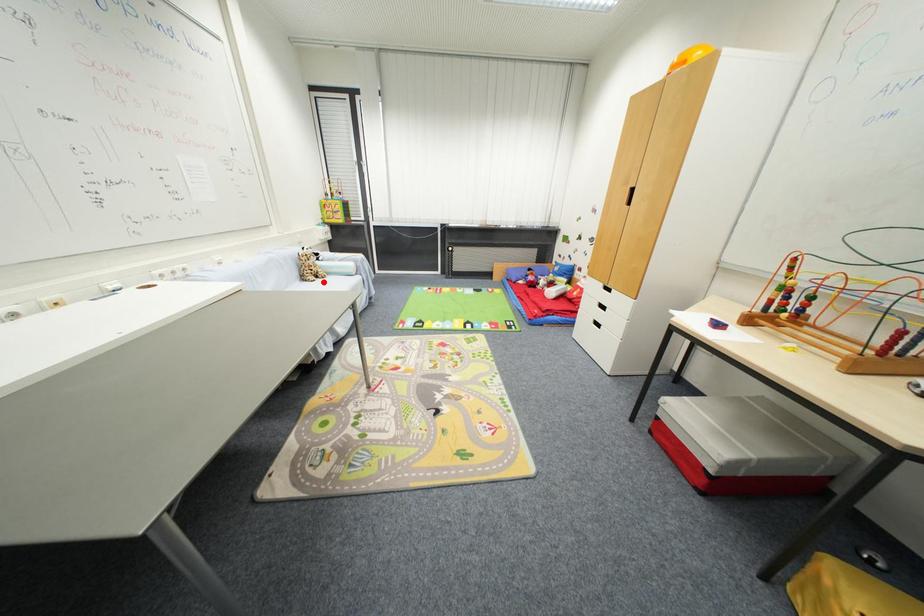
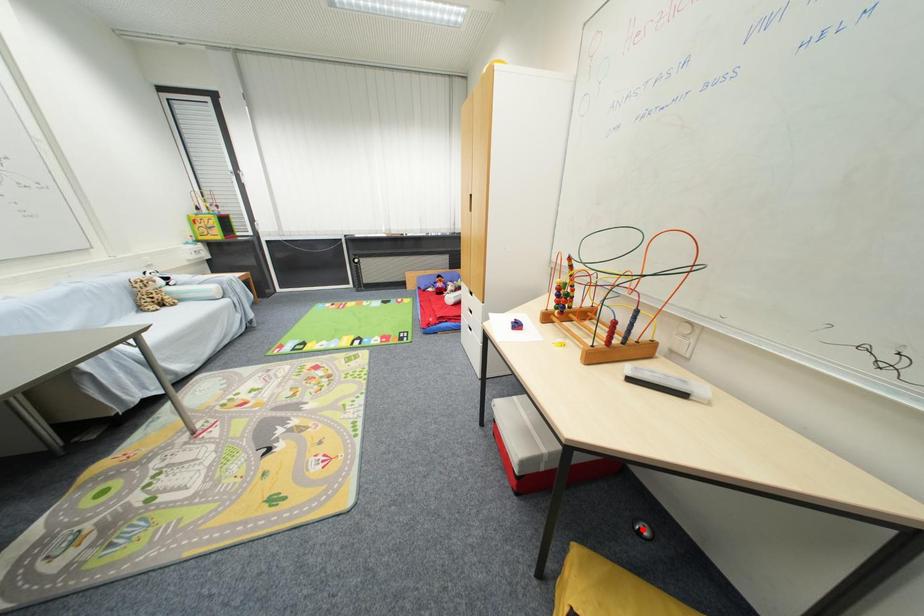
I am providing you with two images of the same scene from different viewpoints. A red point is marked on the first image and another point is marked on the second image. Is the red point in image1 aligned with the point shown in image2?

No